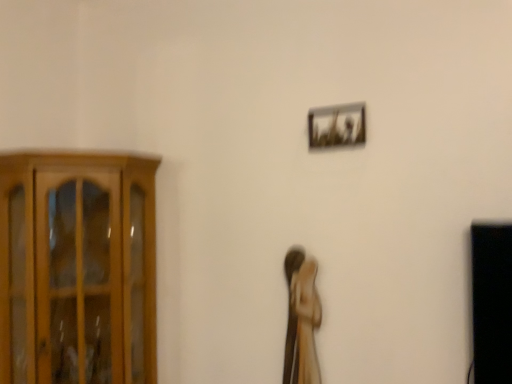
Identify the location of wooden statue at center. (301, 319).

Describe the element at coordinates (337, 126) in the screenshot. I see `metallic silver frame at upper right` at that location.

At what (x,y) coordinates should I click in order to perform the action: click on wooden statue at center. Please return your answer as a coordinate pair (x, y). The image size is (512, 384). Looking at the image, I should click on (301, 319).

From the image's perspective, does wooden cabinet at left appear lower than wooden statue at center?

No, from the image's perspective, wooden cabinet at left is not below wooden statue at center.

Between wooden cabinet at left and wooden statue at center, which one has larger size?

With larger size is wooden cabinet at left.

Would you say wooden cabinet at left is to the left or to the right of wooden statue at center in the picture?

Clearly, wooden cabinet at left is on the left of wooden statue at center in the image.

Is wooden cabinet at left spatially inside wooden statue at center, or outside of it?

wooden cabinet at left is outside wooden statue at center.

Considering the points (311, 111) and (117, 171), which point is behind, point (311, 111) or point (117, 171)?

Point (117, 171)

From their relative heights in the image, would you say metallic silver frame at upper right is taller or shorter than wooden cabinet at left?

Clearly, metallic silver frame at upper right is shorter compared to wooden cabinet at left.

Would you consider metallic silver frame at upper right to be distant from wooden statue at center?

metallic silver frame at upper right is near wooden statue at center, not far away.

Which of these two, metallic silver frame at upper right or wooden statue at center, stands shorter?

With less height is metallic silver frame at upper right.

Is metallic silver frame at upper right to the left or to the right of wooden statue at center in the image?

From the image, it's evident that metallic silver frame at upper right is to the right of wooden statue at center.

In the image, is metallic silver frame at upper right positioned in front of or behind wooden statue at center?

metallic silver frame at upper right is positioned closer to the viewer than wooden statue at center.

From a real-world perspective, is wooden statue at center on top of metallic silver frame at upper right?

Incorrect, from a real-world perspective, wooden statue at center is lower than metallic silver frame at upper right.

Can you tell me how much wooden statue at center and metallic silver frame at upper right differ in facing direction?

They differ by 1.18 degrees in their facing directions.

Considering the positions of objects wooden statue at center and metallic silver frame at upper right in the image provided, who is more to the right, wooden statue at center or metallic silver frame at upper right?

Positioned to the right is metallic silver frame at upper right.

Does point (295, 255) come farther from viewer compared to point (315, 130)?

Yes, point (295, 255) is behind point (315, 130).

In the image, is wooden statue at center on the left side or the right side of wooden cabinet at left?

Clearly, wooden statue at center is on the right of wooden cabinet at left in the image.

From a real-world perspective, is wooden statue at center physically located above or below wooden cabinet at left?

From a real-world perspective, wooden statue at center is physically below wooden cabinet at left.

What are the coordinates of `cupboard in front of the wooden statue at center` in the screenshot? It's located at (77, 268).

From the image's perspective, relative to wooden cabinet at left, is wooden statue at center above or below?

wooden statue at center is below wooden cabinet at left.

The height and width of the screenshot is (384, 512). There is a wooden cabinet at left. Identify the location of picture frame above it (from a real-world perspective). (337, 126).

Looking at the image, does wooden cabinet at left seem bigger or smaller compared to metallic silver frame at upper right?

Clearly, wooden cabinet at left is larger in size than metallic silver frame at upper right.

Is wooden cabinet at left completely or partially outside of metallic silver frame at upper right?

Yes, wooden cabinet at left is located beyond the bounds of metallic silver frame at upper right.

Between wooden cabinet at left and metallic silver frame at upper right, which one has larger width?

wooden cabinet at left.

Find the location of `cupboard that is above the wooden statue at center (from a real-world perspective)`. cupboard that is above the wooden statue at center (from a real-world perspective) is located at coordinates (77, 268).

Find the location of a particular element. This screenshot has width=512, height=384. cupboard below the metallic silver frame at upper right (from a real-world perspective) is located at coordinates (77, 268).

Estimate the real-world distances between objects in this image. Which object is further from wooden statue at center, wooden cabinet at left or metallic silver frame at upper right?

Based on the image, wooden cabinet at left appears to be further to wooden statue at center.

When comparing their distances from wooden cabinet at left, does metallic silver frame at upper right or wooden statue at center seem closer?

wooden statue at center is closer to wooden cabinet at left.

Based on their spatial positions, is wooden cabinet at left or wooden statue at center further from metallic silver frame at upper right?

wooden cabinet at left is positioned further to the anchor metallic silver frame at upper right.

Based on their spatial positions, is wooden statue at center or metallic silver frame at upper right further from wooden cabinet at left?

The object further to wooden cabinet at left is metallic silver frame at upper right.

When comparing their distances from metallic silver frame at upper right, does wooden statue at center or wooden cabinet at left seem further?

wooden cabinet at left is positioned further to the anchor metallic silver frame at upper right.

Consider the image. Based on their spatial positions, is metallic silver frame at upper right or wooden cabinet at left closer to wooden statue at center?

Based on the image, metallic silver frame at upper right appears to be nearer to wooden statue at center.

You are a GUI agent. You are given a task and a screenshot of the screen. Output one action in this format:
    pyautogui.click(x=<x>, y=<y>)
    Task: Click on the woman between wooden cabinet at left and metallic silver frame at upper right
    This screenshot has height=384, width=512.
    Given the screenshot: What is the action you would take?
    pyautogui.click(x=301, y=319)